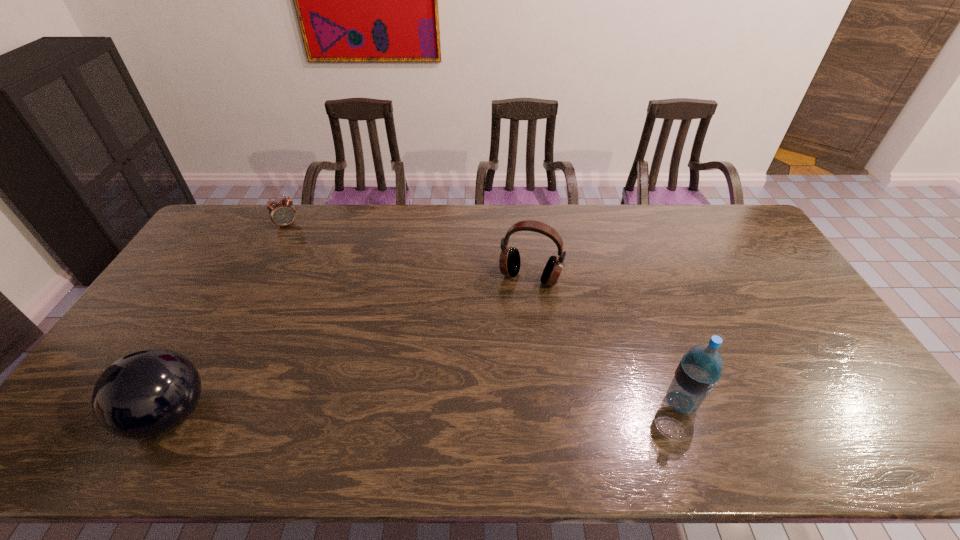
I want to click on bowling ball, so click(145, 394).

Locate an element on the screen. Image resolution: width=960 pixels, height=540 pixels. water bottle is located at coordinates (699, 370).

The image size is (960, 540). What are the coordinates of `the third object from left to right` in the screenshot? It's located at (509, 262).

Identify the location of headset. (509, 262).

This screenshot has height=540, width=960. I want to click on the shortest object, so pyautogui.click(x=282, y=213).

The image size is (960, 540). In order to click on the farthest object in this screenshot , I will do `click(282, 213)`.

In order to click on free space located on the side of the bowling ball with the finger holes in this screenshot , I will do 88,415.

Identify the location of free space located 0.100m on the side of the bowling ball with the finger holes. (88, 415).

The width and height of the screenshot is (960, 540). In order to click on vacant space located 0.110m on the side of the bowling ball with the finger holes in this screenshot , I will do `click(84, 415)`.

The image size is (960, 540). In order to click on vacant space situated 0.280m on the back of the water bottle in this screenshot , I will do `click(646, 307)`.